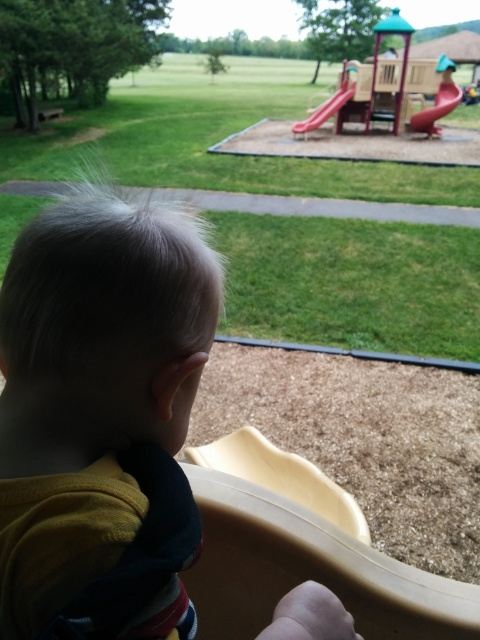
Can you confirm if yellow cotton shirt at lower left is wider than smooth plastic slide at center?

No.

Is yellow cotton shirt at lower left bigger than smooth plastic slide at center?

Actually, yellow cotton shirt at lower left might be smaller than smooth plastic slide at center.

Who is more distant from viewer, (28,592) or (347,99)?

Positioned behind is point (347,99).

Where is `yellow cotton shirt at lower left`? This screenshot has height=640, width=480. yellow cotton shirt at lower left is located at coordinates [x=92, y=385].

Is smooth red slide at upper right closer to camera compared to smooth plastic slide at center?

That is True.

Is smooth red slide at upper right shorter than smooth plastic slide at center?

Yes, smooth red slide at upper right is shorter than smooth plastic slide at center.

Which is behind, point (442, 109) or point (354, 81)?

The point (354, 81) is more distant.

Identify the location of smooth red slide at upper right. (436, 108).

Does yellow cotton shirt at lower left have a lesser height compared to smooth red slide at upper right?

Yes, yellow cotton shirt at lower left is shorter than smooth red slide at upper right.

Who is more forward, (81, 493) or (416, 115)?

Point (81, 493) is in front.

This screenshot has height=640, width=480. Find the location of `yellow cotton shirt at lower left`. yellow cotton shirt at lower left is located at coordinates (92, 385).